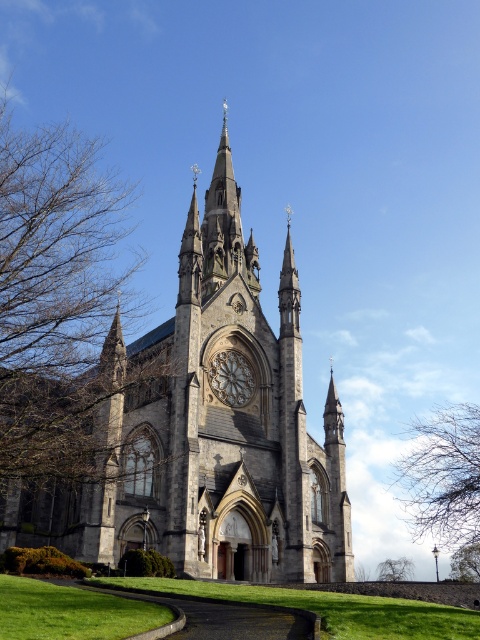
Image resolution: width=480 pixels, height=640 pixels. Identify the location of gray stone church at center. (181, 428).

Between point (253, 355) and point (379, 573), which one is positioned in front?

Positioned in front is point (253, 355).

I want to click on gray stone church at center, so click(x=181, y=428).

At what (x,y) coordinates should I click in order to perform the action: click on gray stone church at center. Please return your answer as a coordinate pair (x, y). This screenshot has height=640, width=480. Looking at the image, I should click on (181, 428).

Who is higher up, brown leafless branches at left or golden stained glass window at center?

brown leafless branches at left is above.

Is point (34, 170) positioned before point (216, 358)?

Yes, point (34, 170) is in front of point (216, 358).

At what (x,y) coordinates should I click in order to perform the action: click on brown leafless branches at left. Please return your answer as a coordinate pair (x, y). The width and height of the screenshot is (480, 640). Looking at the image, I should click on (54, 301).

Find the location of a particular element. The image size is (480, 640). golden stained glass window at center is located at coordinates (231, 378).

Does golden stained glass window at center appear under green leafy tree at lower right?

No.

Is point (224, 394) closer to viewer compared to point (478, 547)?

Yes, point (224, 394) is closer to viewer.

Where is `golden stained glass window at center`? This screenshot has width=480, height=640. golden stained glass window at center is located at coordinates (231, 378).